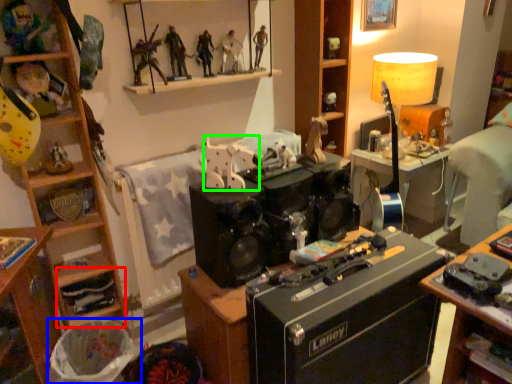
Question: Based on their relative distances, which object is nearer to shelf (highlighted by a red box)? Choose from trash bin/can (highlighted by a blue box) and toy (highlighted by a green box).

Choices:
 (A) trash bin/can
 (B) toy

Answer: (A)